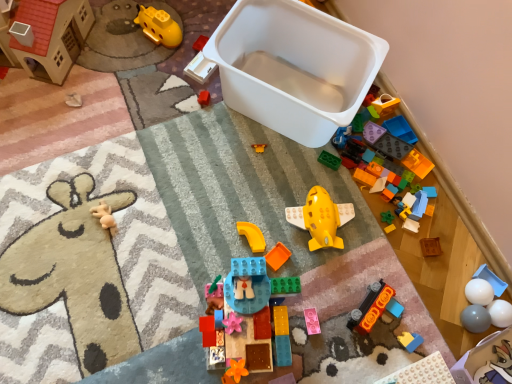
Locate an element on the screen. free space between yellow plastic submarine at upper left, which ranks as the fourteenth toy in right-to-left order, and orange matte block at center, the 11th toy from the right is located at coordinates (210, 136).